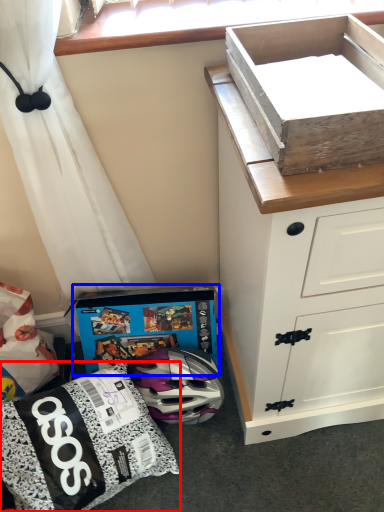
Question: Among these objects, which one is nearest to the camera, kit (highlighted by a red box) or cardboard box (highlighted by a blue box)?

Choices:
 (A) kit
 (B) cardboard box

Answer: (A)